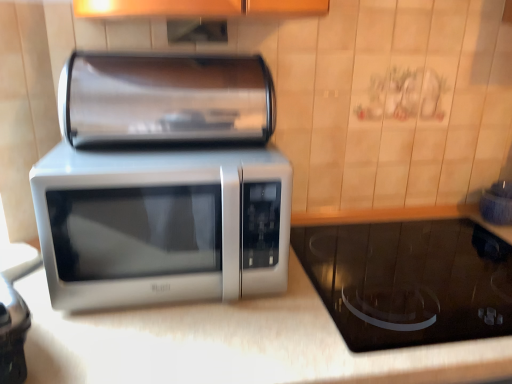
Question: Is black glass cooktop at lower right, which is counted as the second appliance, starting from the left, inside or outside of satin silver paper towel holder at upper center, placed as the second appliance when sorted from right to left?

Choices:
 (A) outside
 (B) inside

Answer: (A)

Question: Is point pos(480,261) closer or farther from the camera than point pos(95,94)?

Choices:
 (A) closer
 (B) farther

Answer: (B)

Question: Considering the real-world distances, which object is closest to the black glass cooktop at lower right, placed as the second appliance when sorted from top to bottom?

Choices:
 (A) satin silver paper towel holder at upper center, the 2th appliance when ordered from bottom to top
 (B) white glossy countertop at center
 (C) satin silver microwave at center

Answer: (B)

Question: Estimate the real-world distances between objects in this image. Which object is closer to the satin silver microwave at center?

Choices:
 (A) satin silver paper towel holder at upper center, which is the first appliance from top to bottom
 (B) white glossy countertop at center
 (C) black glass cooktop at lower right, which is counted as the second appliance, starting from the left

Answer: (A)